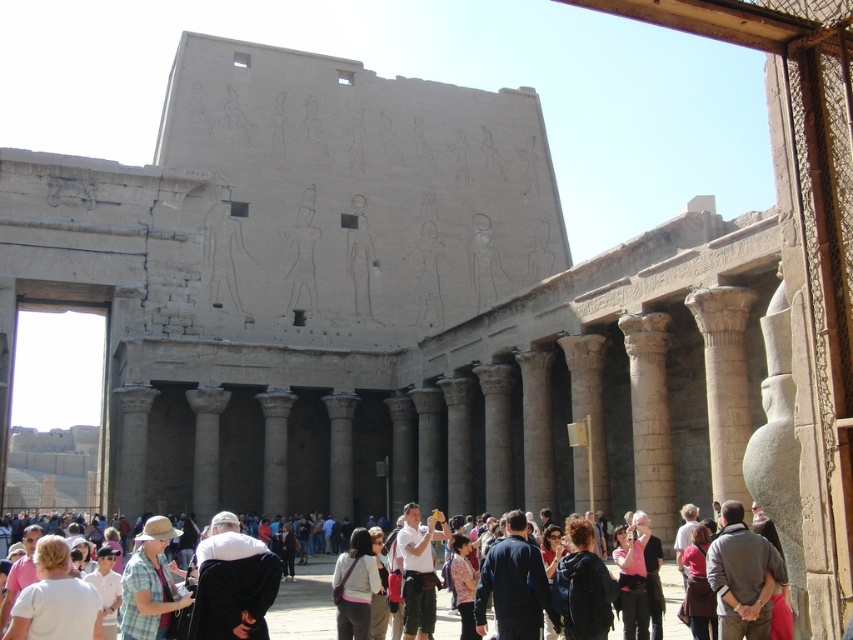
You are a tour guide leading a group at the ancient Egyptian temple. You notice two visitors wearing a matte black jacket at lower center and a matte pink shirt at center. Which visitor is closer to you as you stand at the entrance?

The matte black jacket at lower center is closer to you because the matte pink shirt at center is behind it.